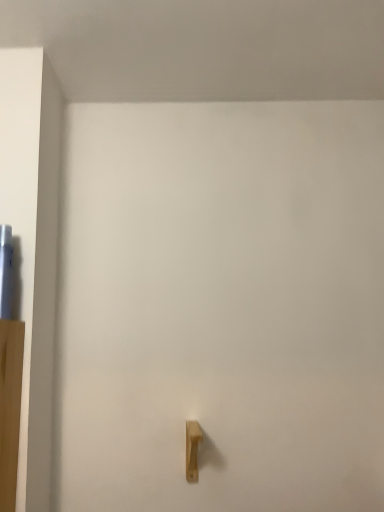
The height and width of the screenshot is (512, 384). Describe the element at coordinates (192, 449) in the screenshot. I see `wooden door handle at center` at that location.

The width and height of the screenshot is (384, 512). I want to click on wooden door handle at center, so click(x=192, y=449).

The image size is (384, 512). What are the coordinates of `wooden door handle at center` in the screenshot? It's located at (192, 449).